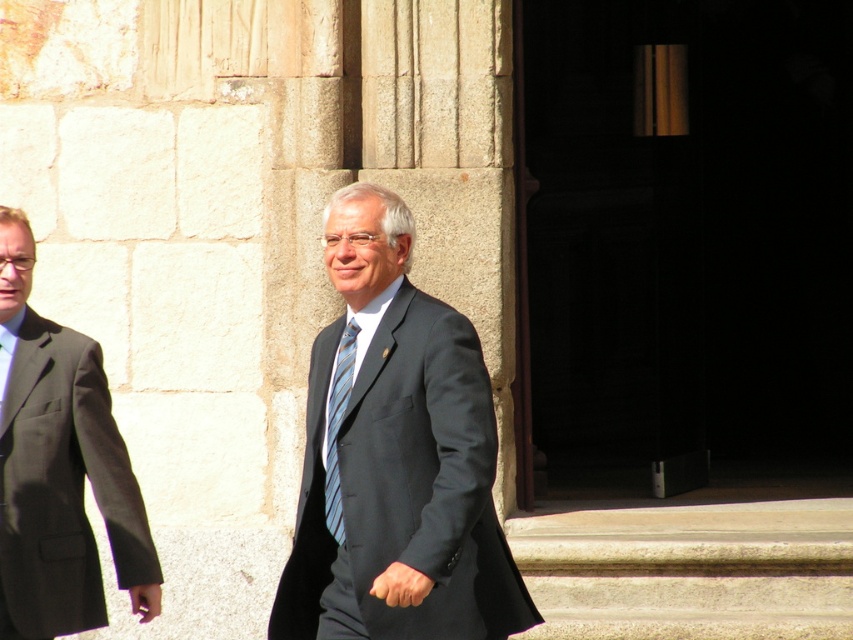
Between point (426, 336) and point (61, 584), which one is positioned in front?

Point (426, 336) is more forward.

Is matte black suit at center shorter than matte black suit at left?

No, matte black suit at center is not shorter than matte black suit at left.

Does point (335, 342) lie behind point (99, 433)?

That is False.

Find the location of `matte black suit at center`. matte black suit at center is located at coordinates (395, 456).

Can you confirm if matte black suit at left is shorter than striped fabric tie at center?

No.

Who is more distant from viewer, (32,417) or (329,419)?

The point (32,417) is behind.

Between point (16, 237) and point (339, 497), which one is positioned in front?

Point (339, 497) is more forward.

The height and width of the screenshot is (640, 853). In order to click on matte black suit at left in this screenshot , I will do `click(59, 468)`.

Who is more forward, (381, 598) or (352, 348)?

Point (381, 598) is more forward.

Is matte black suit at center shorter than striped fabric tie at center?

No.

Where is `matte black suit at center`? The width and height of the screenshot is (853, 640). matte black suit at center is located at coordinates (395, 456).